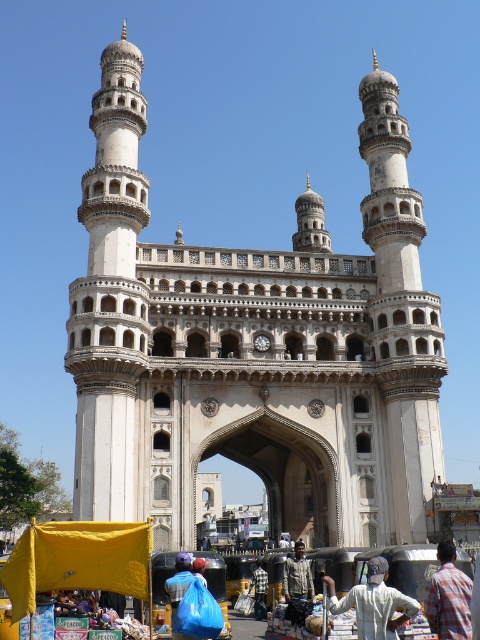
You are standing at the base of the monument and want to reach the point marked at coordinates (468, 616). Given that the camera is positioned 50 meters away from the monument, can you estimate how far you need to walk from your current position to reach that point?

The point at coordinates (468, 616) is 38.71 meters away from the camera, which is positioned 50 meters away from the monument. Therefore, you would need to walk approximately 11.29 meters towards the monument from your current position to reach that point.

You are standing at the base of the monument and want to take a photo of the point at coordinates point (x=392, y=621). If your camera has a maximum focus range of 40 meters, will it be able to focus on that point?

The distance of point (x=392, y=621) from camera is 38.90 meters, which is within the camera maximum focus range of 40 meters. So yes, the camera can focus on that point.